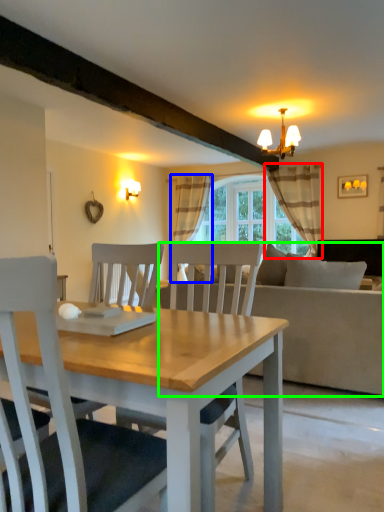
Question: Which is farther away from curtain (highlighted by a red box)? curtain (highlighted by a blue box) or studio couch (highlighted by a green box)?

Choices:
 (A) curtain
 (B) studio couch

Answer: (B)